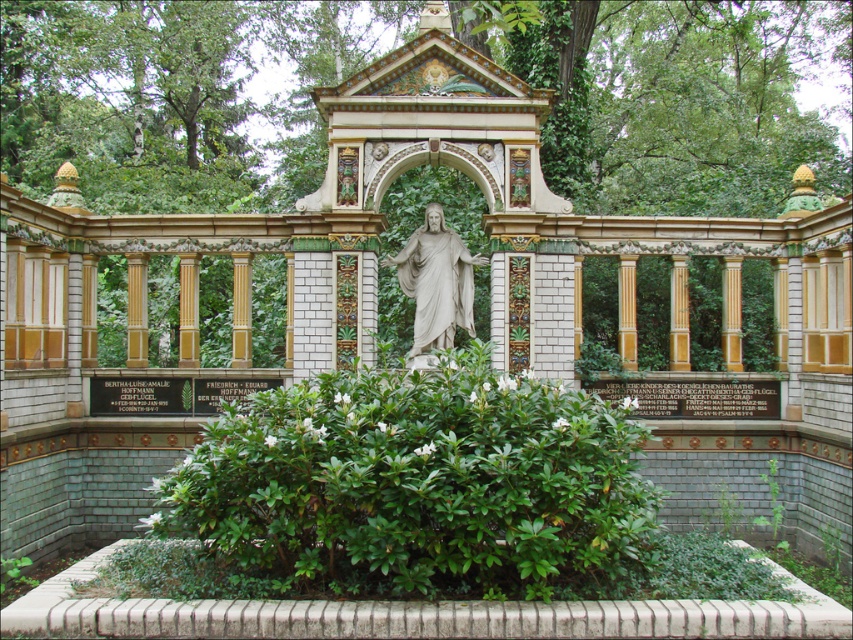
Looking at this image, can you confirm if green leafy bush at center is bigger than white marble statue at center?

Correct, green leafy bush at center is larger in size than white marble statue at center.

You are a GUI agent. You are given a task and a screenshot of the screen. Output one action in this format:
    pyautogui.click(x=<x>, y=<y>)
    Task: Click on the green leafy bush at center
    The image size is (853, 640).
    Given the screenshot: What is the action you would take?
    pyautogui.click(x=415, y=490)